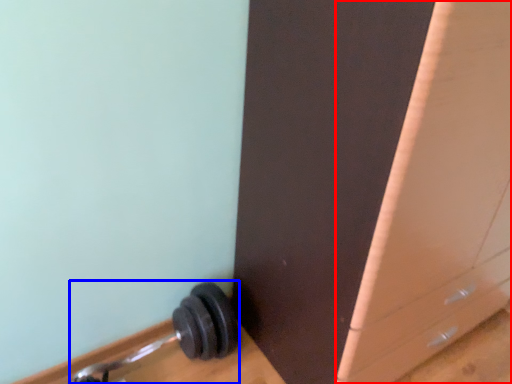
Question: Among these objects, which one is nearest to the camera, file cabinet (highlighted by a red box) or dumbbell (highlighted by a blue box)?

Choices:
 (A) file cabinet
 (B) dumbbell

Answer: (A)